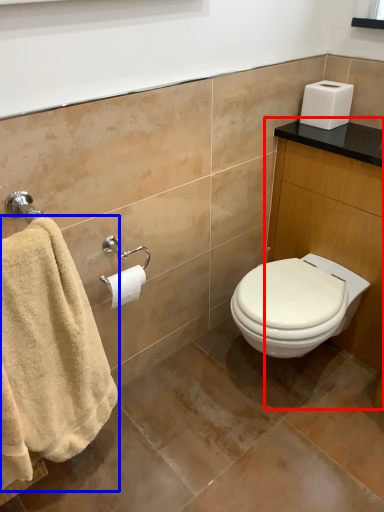
Question: Which object appears closest to the camera in this image, vanity (highlighted by a red box) or towel (highlighted by a blue box)?

Choices:
 (A) vanity
 (B) towel

Answer: (B)